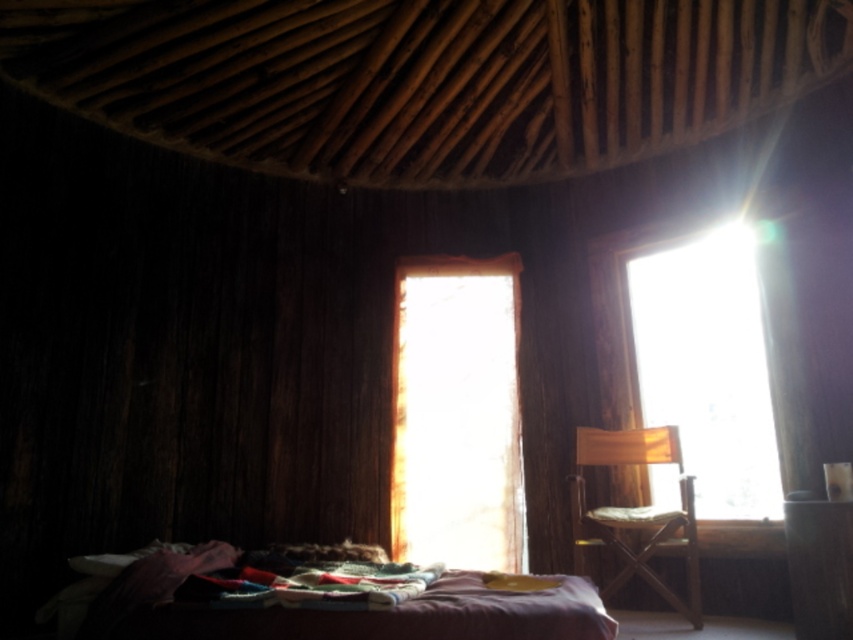
Which is behind, point (503, 317) or point (576, 541)?

The point (503, 317) is more distant.

Describe the element at coordinates (457, 413) in the screenshot. I see `translucent fabric at center` at that location.

Find the location of a particular element. translucent fabric at center is located at coordinates (457, 413).

Is transparent glass window at upper right thinner than wooden director's chair at center?

In fact, transparent glass window at upper right might be wider than wooden director's chair at center.

Is transparent glass window at upper right below wooden director's chair at center?

Incorrect, transparent glass window at upper right is not positioned below wooden director's chair at center.

Which is behind, point (703, 260) or point (614, 529)?

The point (703, 260) is more distant.

The image size is (853, 640). In order to click on transparent glass window at upper right in this screenshot , I will do `click(706, 364)`.

Can you confirm if purple fabric bed at lower center is thinner than wooden director's chair at center?

No.

Does point (106, 621) come closer to viewer compared to point (607, 529)?

That is True.

Is point (560, 580) behind point (576, 516)?

No, (560, 580) is in front of (576, 516).

Locate an element on the screen. This screenshot has width=853, height=640. purple fabric bed at lower center is located at coordinates (318, 609).